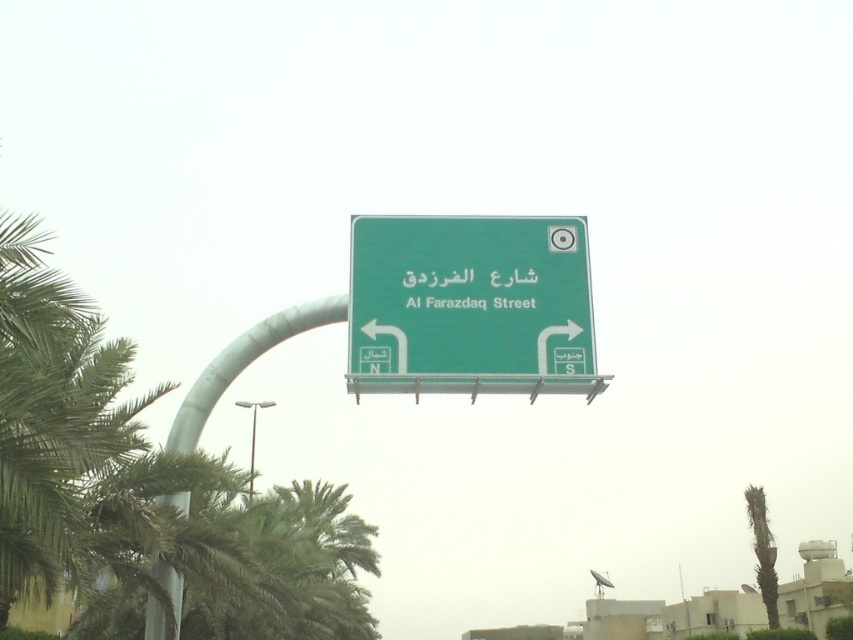
You are standing at the intersection and see both the green matte signboard at center and the green metallic sign at center. Which one is positioned to the right side from your perspective?

The green matte signboard at center is positioned to the right of the green metallic sign at center.

You are a delivery driver who needs to choose between two routes based on the signboard and sign details. The green matte signboard at center and the green metallic sign at center both show directions. Which one is taller so you can read it better from a distance?

The green matte signboard at center is taller than the green metallic sign at center, so it can be read better from a distance.

You are a pedestrian trying to read the road sign. Which object, the green matte signboard at center or the green metallic sign at center, will you see first as you approach the sign?

The green matte signboard at center is closer to the viewer than the green metallic sign at center, so you will see the green matte signboard at center first as you approach the sign.